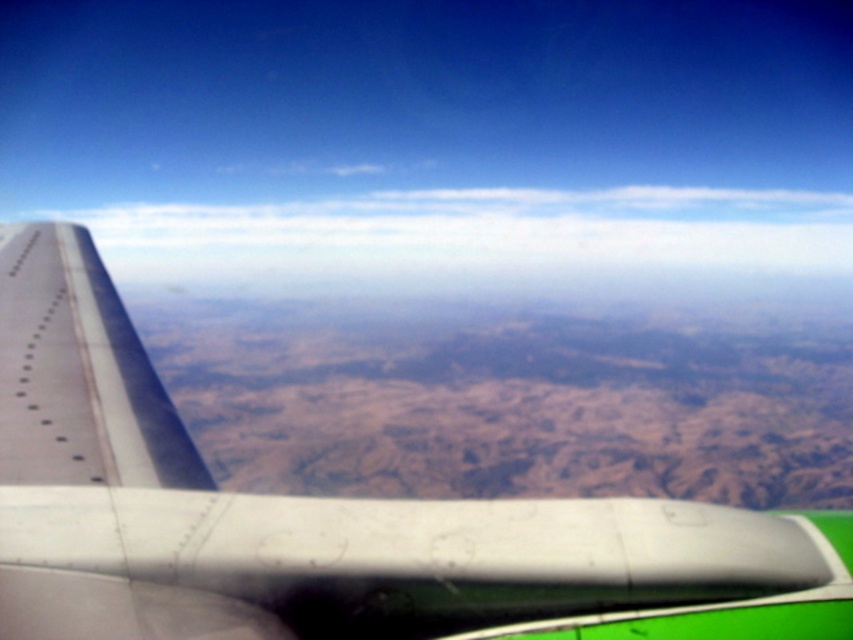
Question: Is the position of metallic gray wing at left more distant than that of white fluffy cloud at upper center?

Choices:
 (A) no
 (B) yes

Answer: (A)

Question: Among these objects, which one is farthest from the camera?

Choices:
 (A) metallic gray wing at left
 (B) white fluffy cloud at upper center

Answer: (B)

Question: In this image, where is metallic gray wing at left located relative to white fluffy cloud at upper center?

Choices:
 (A) below
 (B) above

Answer: (A)

Question: Among these objects, which one is nearest to the camera?

Choices:
 (A) white fluffy cloud at upper center
 (B) metallic gray wing at left

Answer: (B)

Question: Considering the relative positions of metallic gray wing at left and white fluffy cloud at upper center in the image provided, where is metallic gray wing at left located with respect to white fluffy cloud at upper center?

Choices:
 (A) left
 (B) right

Answer: (A)